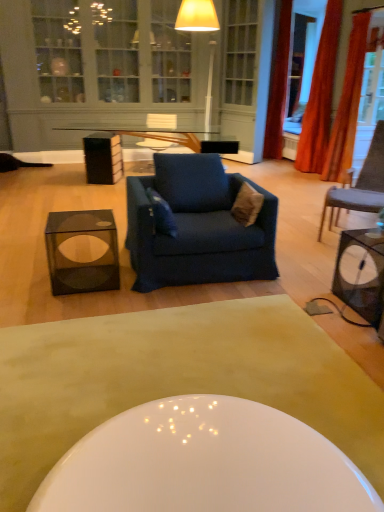
Question: From the image's perspective, is blue fabric armchair at center over transparent glass cube at lower left, which is the 1th table in left-to-right order?

Choices:
 (A) no
 (B) yes

Answer: (B)

Question: Is blue fabric armchair at center positioned in front of transparent glass cube at lower left, which is the 1th table in left-to-right order?

Choices:
 (A) yes
 (B) no

Answer: (B)

Question: Can you confirm if blue fabric armchair at center is wider than transparent glass cube at lower left, which is the 1th table in left-to-right order?

Choices:
 (A) no
 (B) yes

Answer: (B)

Question: Is blue fabric armchair at center looking in the opposite direction of transparent glass cube at lower left, which is the 1th table in left-to-right order?

Choices:
 (A) no
 (B) yes

Answer: (A)

Question: From a real-world perspective, is blue fabric armchair at center below transparent glass cube at lower left, the second table when ordered from right to left?

Choices:
 (A) no
 (B) yes

Answer: (A)

Question: From the image's perspective, is transparent glass cube at lower left, which is the 1th table in left-to-right order, positioned above or below orange fabric curtain at right, the 3th curtain when ordered from back to front?

Choices:
 (A) above
 (B) below

Answer: (B)

Question: From their relative heights in the image, would you say transparent glass cube at lower left, the second table when ordered from right to left, is taller or shorter than orange fabric curtain at right, the 1th curtain from the front?

Choices:
 (A) short
 (B) tall

Answer: (A)

Question: Would you say transparent glass cube at lower left, which is the 1th table in left-to-right order, is to the left or to the right of orange fabric curtain at right, the 1th curtain from the front, in the picture?

Choices:
 (A) left
 (B) right

Answer: (A)

Question: In terms of size, does transparent glass cube at lower left, the second table when ordered from right to left, appear bigger or smaller than orange fabric curtain at right, the 1th curtain from the front?

Choices:
 (A) big
 (B) small

Answer: (B)

Question: From a real-world perspective, is matte glass cabinet at upper center physically located above or below transparent glass cube at lower left, which is the 1th table in left-to-right order?

Choices:
 (A) above
 (B) below

Answer: (A)

Question: Considering the positions of point (112, 90) and point (109, 284), is point (112, 90) closer or farther from the camera than point (109, 284)?

Choices:
 (A) farther
 (B) closer

Answer: (A)

Question: Is matte glass cabinet at upper center wider or thinner than transparent glass cube at lower left, which is the 1th table in left-to-right order?

Choices:
 (A) wide
 (B) thin

Answer: (B)

Question: Is matte glass cabinet at upper center bigger or smaller than transparent glass cube at lower left, the second table when ordered from right to left?

Choices:
 (A) big
 (B) small

Answer: (A)

Question: Considering their positions, is brown fuzzy pillow at center, positioned as the 2th pillow in left-to-right order, located in front of or behind metallic black table at right, placed as the first table when sorted from right to left?

Choices:
 (A) behind
 (B) front

Answer: (A)

Question: From a real-world perspective, is brown fuzzy pillow at center, positioned as the 2th pillow in left-to-right order, positioned above or below metallic black table at right, placed as the first table when sorted from right to left?

Choices:
 (A) above
 (B) below

Answer: (A)